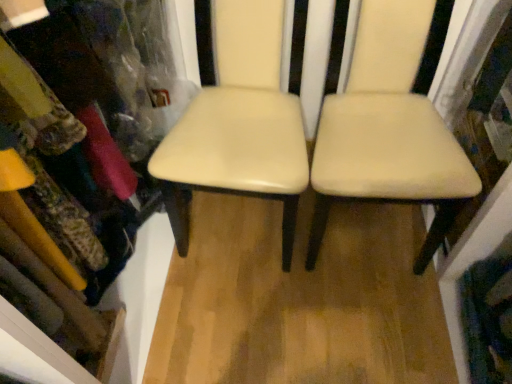
The image size is (512, 384). In order to click on matte plastic bookshelf at upper left in this screenshot , I will do `click(94, 228)`.

In order to click on cream leather chair at center, acting as the 1th chair starting from the left in this screenshot , I will do `click(242, 118)`.

Considering the sizes of beige leather chair at center, which is counted as the second chair, starting from the left, and matte plastic bookshelf at upper left in the image, is beige leather chair at center, which is counted as the second chair, starting from the left, wider or thinner than matte plastic bookshelf at upper left?

Clearly, beige leather chair at center, which is counted as the second chair, starting from the left, has more width compared to matte plastic bookshelf at upper left.

Would you say matte plastic bookshelf at upper left is part of beige leather chair at center, positioned as the first chair in right-to-left order,'s contents?

No, matte plastic bookshelf at upper left is not inside beige leather chair at center, positioned as the first chair in right-to-left order.

From the image's perspective, relative to matte plastic bookshelf at upper left, is beige leather chair at center, which is counted as the second chair, starting from the left, above or below?

beige leather chair at center, which is counted as the second chair, starting from the left, is situated higher than matte plastic bookshelf at upper left in the image.

Is beige leather chair at center, which is counted as the second chair, starting from the left, positioned with its back to matte plastic bookshelf at upper left?

beige leather chair at center, which is counted as the second chair, starting from the left, is not turned away from matte plastic bookshelf at upper left.

Between matte plastic bookshelf at upper left and beige leather chair at center, positioned as the first chair in right-to-left order, which one has larger width?

Wider between the two is beige leather chair at center, positioned as the first chair in right-to-left order.

Is matte plastic bookshelf at upper left placed right next to beige leather chair at center, positioned as the first chair in right-to-left order?

No, matte plastic bookshelf at upper left is not beside beige leather chair at center, positioned as the first chair in right-to-left order.

Is point (106, 206) closer to camera compared to point (398, 135)?

That is False.

Is matte plastic bookshelf at upper left to the left of beige leather chair at center, which is counted as the second chair, starting from the left, from the viewer's perspective?

Yes.

Consider the image. Does matte plastic bookshelf at upper left have a larger size compared to cream leather chair at center, acting as the 1th chair starting from the left?

Indeed, matte plastic bookshelf at upper left has a larger size compared to cream leather chair at center, acting as the 1th chair starting from the left.

Which is in front, matte plastic bookshelf at upper left or cream leather chair at center, which is the 2th chair in right-to-left order?

matte plastic bookshelf at upper left is closer to the camera.

In the image, is matte plastic bookshelf at upper left on the left side or the right side of cream leather chair at center, which is the 2th chair in right-to-left order?

From the image, it's evident that matte plastic bookshelf at upper left is to the left of cream leather chair at center, which is the 2th chair in right-to-left order.

Which is farther from the camera, [28,85] or [195,151]?

The point [195,151] is behind.

Are beige leather chair at center, positioned as the first chair in right-to-left order, and cream leather chair at center, which is the 2th chair in right-to-left order, making contact?

No, beige leather chair at center, positioned as the first chair in right-to-left order, is not touching cream leather chair at center, which is the 2th chair in right-to-left order.

This screenshot has width=512, height=384. What are the coordinates of `chair lying on the right of cream leather chair at center, which is the 2th chair in right-to-left order` in the screenshot? It's located at (390, 126).

Is beige leather chair at center, which is counted as the second chair, starting from the left, taller or shorter than cream leather chair at center, acting as the 1th chair starting from the left?

In the image, beige leather chair at center, which is counted as the second chair, starting from the left, appears to be shorter than cream leather chair at center, acting as the 1th chair starting from the left.

Is beige leather chair at center, which is counted as the second chair, starting from the left, oriented towards cream leather chair at center, which is the 2th chair in right-to-left order?

No, beige leather chair at center, which is counted as the second chair, starting from the left, does not turn towards cream leather chair at center, which is the 2th chair in right-to-left order.

Is cream leather chair at center, which is the 2th chair in right-to-left order, far from matte plastic bookshelf at upper left?

cream leather chair at center, which is the 2th chair in right-to-left order, is actually quite close to matte plastic bookshelf at upper left.

Which object is closer to the camera, cream leather chair at center, acting as the 1th chair starting from the left, or matte plastic bookshelf at upper left?

matte plastic bookshelf at upper left is more forward.

Does cream leather chair at center, acting as the 1th chair starting from the left, turn towards matte plastic bookshelf at upper left?

No, cream leather chair at center, acting as the 1th chair starting from the left, is not facing towards matte plastic bookshelf at upper left.

Considering the sizes of objects cream leather chair at center, acting as the 1th chair starting from the left, and matte plastic bookshelf at upper left in the image provided, who is taller, cream leather chair at center, acting as the 1th chair starting from the left, or matte plastic bookshelf at upper left?

Standing taller between the two is matte plastic bookshelf at upper left.

Which is behind, point (258, 107) or point (377, 20)?

The point (258, 107) is more distant.

The width and height of the screenshot is (512, 384). Identify the location of chair on the left of beige leather chair at center, which is counted as the second chair, starting from the left. (242, 118).

Is cream leather chair at center, acting as the 1th chair starting from the left, located outside beige leather chair at center, positioned as the first chair in right-to-left order?

Yes, cream leather chair at center, acting as the 1th chair starting from the left, is outside of beige leather chair at center, positioned as the first chair in right-to-left order.

Consider the image. From a real-world perspective, which object stands above the other?

From a 3D spatial view, cream leather chair at center, which is the 2th chair in right-to-left order, is above.

In the image, there is a beige leather chair at center, positioned as the first chair in right-to-left order. Identify the location of bookshelf below it (from the image's perspective). (94, 228).

There is a matte plastic bookshelf at upper left. Where is `the 1st chair above it (from the image's perspective)`? This screenshot has width=512, height=384. the 1st chair above it (from the image's perspective) is located at coordinates (390, 126).

Which object lies further to the anchor point cream leather chair at center, acting as the 1th chair starting from the left, beige leather chair at center, positioned as the first chair in right-to-left order, or matte plastic bookshelf at upper left?

Based on the image, matte plastic bookshelf at upper left appears to be further to cream leather chair at center, acting as the 1th chair starting from the left.

From the image, which object appears to be farther from matte plastic bookshelf at upper left, beige leather chair at center, positioned as the first chair in right-to-left order, or cream leather chair at center, which is the 2th chair in right-to-left order?

beige leather chair at center, positioned as the first chair in right-to-left order.

Which object lies nearer to the anchor point matte plastic bookshelf at upper left, cream leather chair at center, acting as the 1th chair starting from the left, or beige leather chair at center, which is counted as the second chair, starting from the left?

Based on the image, cream leather chair at center, acting as the 1th chair starting from the left, appears to be nearer to matte plastic bookshelf at upper left.

Looking at this image, when comparing their distances from beige leather chair at center, which is counted as the second chair, starting from the left, does cream leather chair at center, acting as the 1th chair starting from the left, or matte plastic bookshelf at upper left seem closer?

Based on the image, cream leather chair at center, acting as the 1th chair starting from the left, appears to be nearer to beige leather chair at center, which is counted as the second chair, starting from the left.

Estimate the real-world distances between objects in this image. Which object is further from cream leather chair at center, acting as the 1th chair starting from the left, matte plastic bookshelf at upper left or beige leather chair at center, positioned as the first chair in right-to-left order?

matte plastic bookshelf at upper left lies further to cream leather chair at center, acting as the 1th chair starting from the left, than the other object.

From the picture: Considering their positions, is matte plastic bookshelf at upper left positioned further to beige leather chair at center, positioned as the first chair in right-to-left order, than cream leather chair at center, acting as the 1th chair starting from the left?

matte plastic bookshelf at upper left is positioned further to the anchor beige leather chair at center, positioned as the first chair in right-to-left order.

Locate an element on the screen. chair located between matte plastic bookshelf at upper left and beige leather chair at center, positioned as the first chair in right-to-left order, in the left-right direction is located at coordinates coord(242,118).